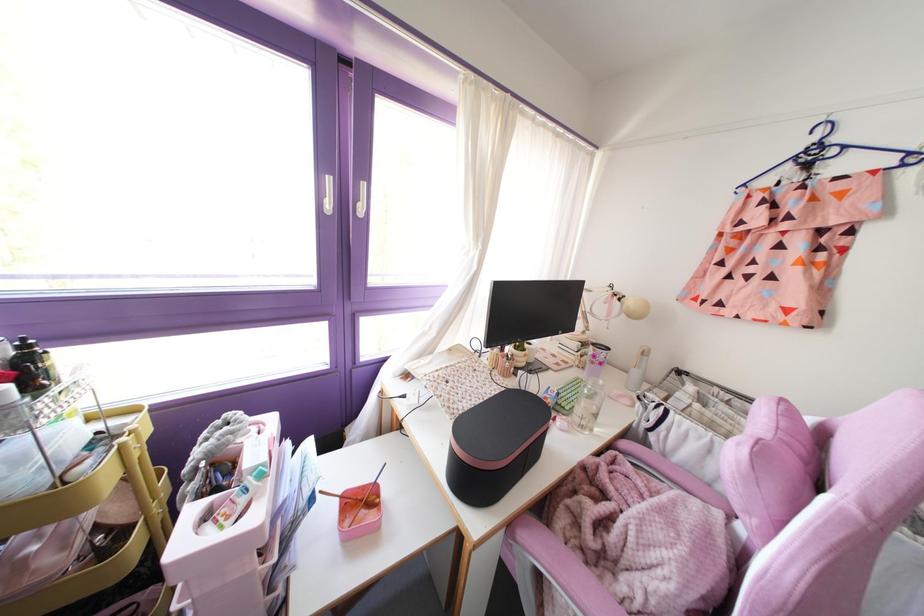
Which object does [100,516] point to?

This point indicates the yellow storage cart.